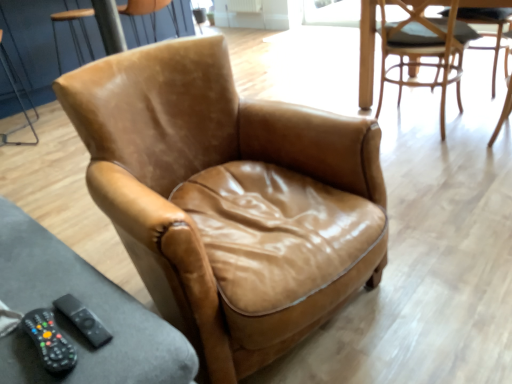
Question: From the image's perspective, is brown leather armchair at upper left, which is counted as the third chair, starting from the right, on top of black plastic remote at lower left?

Choices:
 (A) no
 (B) yes

Answer: (B)

Question: Could you tell me if brown leather armchair at upper left, which is counted as the 3th chair, starting from the front, is turned towards black plastic remote at lower left?

Choices:
 (A) no
 (B) yes

Answer: (A)

Question: Is brown leather armchair at upper left, marked as the first chair in a left-to-right arrangement, wider than black plastic remote at lower left?

Choices:
 (A) no
 (B) yes

Answer: (B)

Question: Is brown leather armchair at upper left, marked as the first chair in a left-to-right arrangement, at the right side of black plastic remote at lower left?

Choices:
 (A) no
 (B) yes

Answer: (A)

Question: Considering the relative sizes of brown leather armchair at upper left, the 1th chair when ordered from back to front, and black plastic remote at lower left in the image provided, is brown leather armchair at upper left, the 1th chair when ordered from back to front, taller than black plastic remote at lower left?

Choices:
 (A) no
 (B) yes

Answer: (B)

Question: In terms of width, does light brown leather chair at upper right, which ranks as the 1th chair in right-to-left order, look wider or thinner when compared to black rubber remote control at lower left?

Choices:
 (A) wide
 (B) thin

Answer: (A)

Question: Considering the positions of point (426, 62) and point (50, 332), is point (426, 62) closer or farther from the camera than point (50, 332)?

Choices:
 (A) farther
 (B) closer

Answer: (A)

Question: In terms of size, does light brown leather chair at upper right, which ranks as the 1th chair in right-to-left order, appear bigger or smaller than black rubber remote control at lower left?

Choices:
 (A) small
 (B) big

Answer: (B)

Question: In terms of height, does light brown leather chair at upper right, acting as the 2th chair starting from the front, look taller or shorter compared to black rubber remote control at lower left?

Choices:
 (A) short
 (B) tall

Answer: (B)

Question: From a real-world perspective, relative to light brown leather chair at upper right, acting as the 2th chair starting from the front, is leather armchair at center, the 3th chair in the back-to-front sequence, vertically above or below?

Choices:
 (A) above
 (B) below

Answer: (A)

Question: Is leather armchair at center, the 3th chair in the back-to-front sequence, wider or thinner than light brown leather chair at upper right, which is the second chair in back-to-front order?

Choices:
 (A) wide
 (B) thin

Answer: (A)

Question: Which is correct: leather armchair at center, which is the second chair in right-to-left order, is inside light brown leather chair at upper right, which ranks as the 1th chair in right-to-left order, or outside of it?

Choices:
 (A) inside
 (B) outside

Answer: (B)

Question: From the image's perspective, is leather armchair at center, positioned as the second chair in left-to-right order, positioned above or below light brown leather chair at upper right, the third chair in the left-to-right sequence?

Choices:
 (A) above
 (B) below

Answer: (B)

Question: Looking at their shapes, would you say black plastic remote at lower left is wider or thinner than brown leather armchair at upper left, the 1th chair when ordered from back to front?

Choices:
 (A) thin
 (B) wide

Answer: (A)

Question: Considering the positions of point (89, 327) and point (136, 34), is point (89, 327) closer or farther from the camera than point (136, 34)?

Choices:
 (A) farther
 (B) closer

Answer: (B)